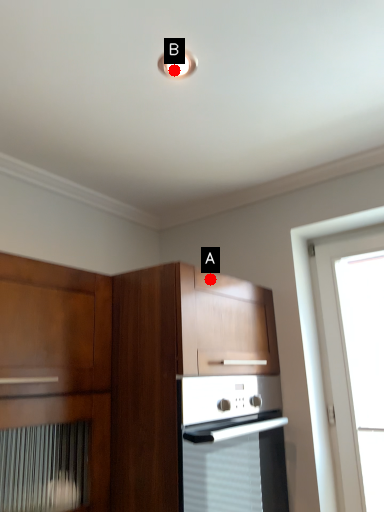
Question: Two points are circled on the image, labeled by A and B beside each circle. Which point appears farthest from the camera in this image?

Choices:
 (A) A is further
 (B) B is further

Answer: (A)